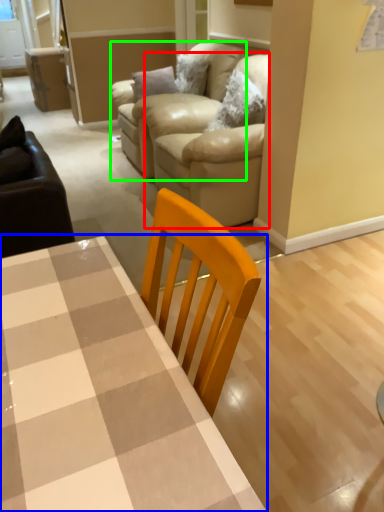
Question: Estimate the real-world distances between objects in this image. Which object is farther from couch (highlighted by a red box), table (highlighted by a blue box) or armchair (highlighted by a green box)?

Choices:
 (A) table
 (B) armchair

Answer: (A)